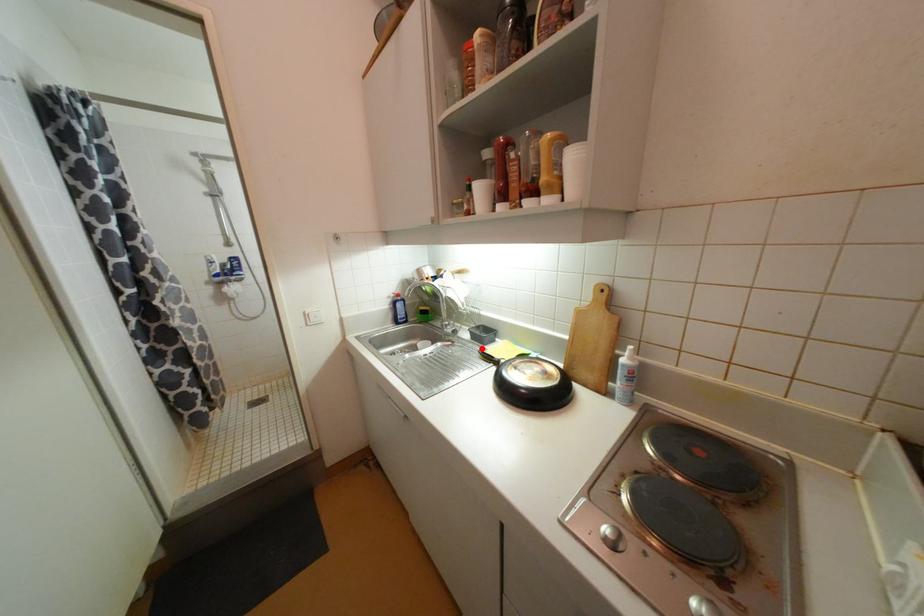
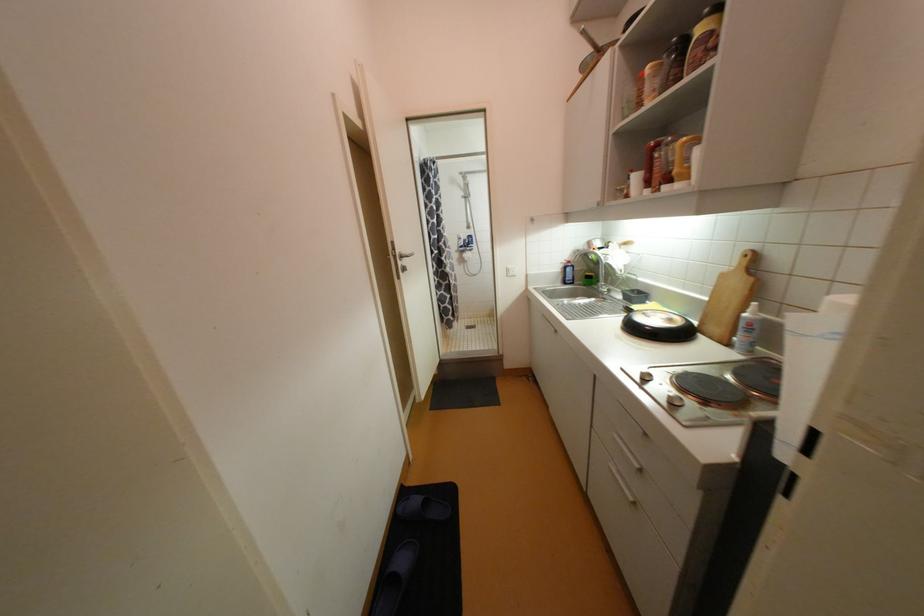
Question: I am providing you with two images of the same scene from different viewpoints. A red point is marked on the first image. Can you still see the location of the red point in image 2?

Choices:
 (A) Yes
 (B) No

Answer: (A)